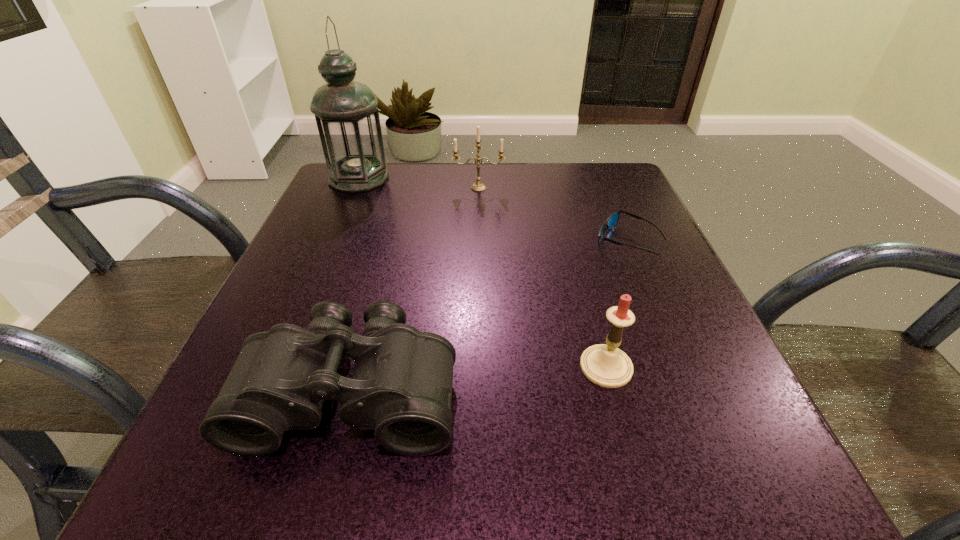
You are a GUI agent. You are given a task and a screenshot of the screen. Output one action in this format:
    pyautogui.click(x=<x>, y=<y>)
    Task: Click on the vacant area that lies between the oil lamp and the binoculars
    This screenshot has height=540, width=960.
    Given the screenshot: What is the action you would take?
    pyautogui.click(x=355, y=285)

Where is `free space between the tallest object and the binoculars`? Image resolution: width=960 pixels, height=540 pixels. free space between the tallest object and the binoculars is located at coordinates (355, 285).

Identify the location of unoccupied position between the rightmost object and the farther candle. This screenshot has height=540, width=960. (553, 214).

I want to click on vacant region between the farther candle and the nearer candle, so click(x=542, y=278).

Identify the location of free space between the tallest object and the binoculars. [355, 285].

Where is `empty location between the tallest object and the left candle`? The width and height of the screenshot is (960, 540). empty location between the tallest object and the left candle is located at coordinates (419, 183).

You are a GUI agent. You are given a task and a screenshot of the screen. Output one action in this format:
    pyautogui.click(x=<x>, y=<y>)
    Task: Click on the blank region between the fourth object from left to right and the fourth tallest object
    Image resolution: width=960 pixels, height=540 pixels.
    Given the screenshot: What is the action you would take?
    pyautogui.click(x=479, y=379)

You are a GUI agent. You are given a task and a screenshot of the screen. Output one action in this format:
    pyautogui.click(x=<x>, y=<y>)
    Task: Click on the free spot between the fourth tallest object and the oil lamp
    
    Given the screenshot: What is the action you would take?
    pyautogui.click(x=355, y=285)

The width and height of the screenshot is (960, 540). I want to click on free space between the right candle and the sunglasses, so click(616, 304).

The image size is (960, 540). I want to click on the fourth closest object to the binoculars, so click(x=478, y=186).